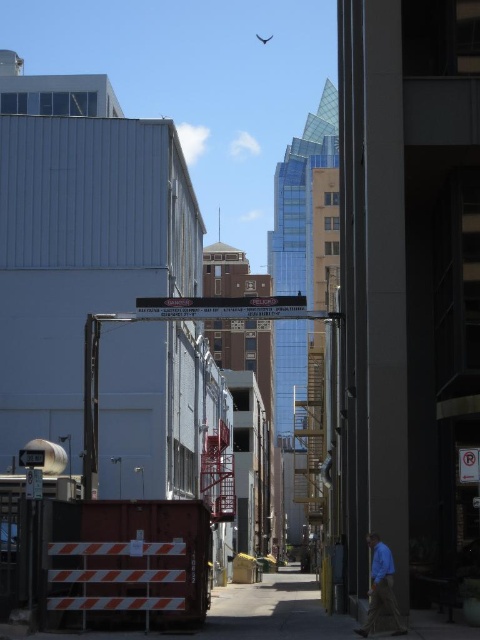
Question: Does orange striped barrier at lower left have a greater width compared to blue cotton shirt at lower right?

Choices:
 (A) no
 (B) yes

Answer: (B)

Question: Is blue cotton shirt at lower right closer to camera compared to transparent plastic fly at upper center?

Choices:
 (A) yes
 (B) no

Answer: (A)

Question: Which point is farther from the camera taking this photo?

Choices:
 (A) (326, 620)
 (B) (384, 552)
 (C) (268, 40)

Answer: (C)

Question: Which of the following is the farthest from the observer?

Choices:
 (A) (397, 618)
 (B) (351, 628)
 (C) (259, 35)

Answer: (C)

Question: Which object is positioned farthest from the blue cotton shirt at lower right?

Choices:
 (A) transparent plastic fly at upper center
 (B) orange striped barrier at lower left

Answer: (A)

Question: Can you confirm if orange striped barrier at lower left is positioned below transparent plastic fly at upper center?

Choices:
 (A) yes
 (B) no

Answer: (A)